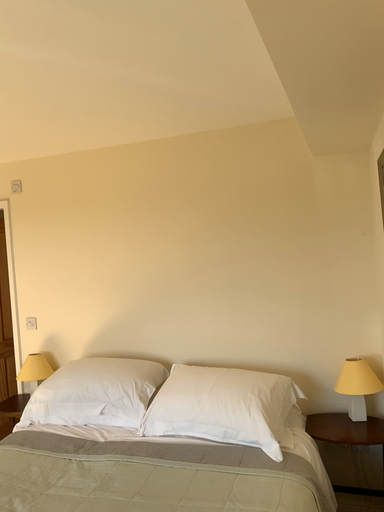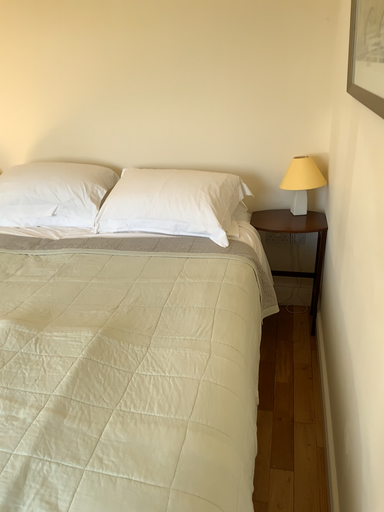
Question: Which way did the camera rotate in the video?

Choices:
 (A) rotated upward
 (B) rotated downward

Answer: (B)